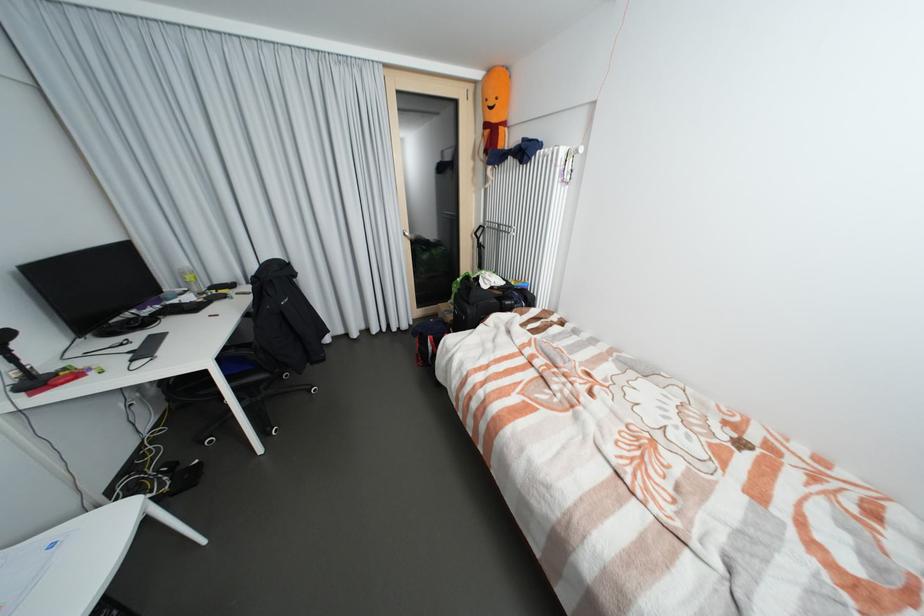
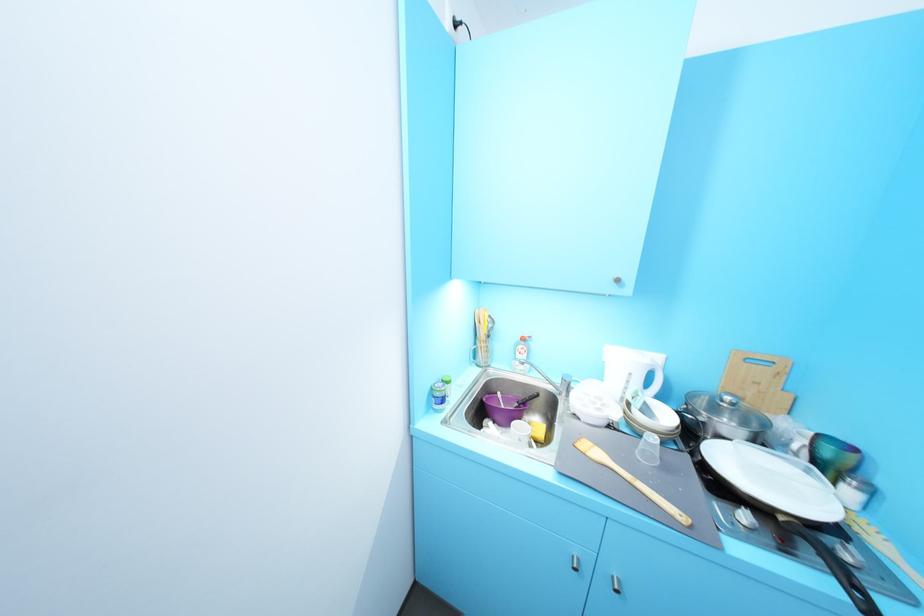
Question: I am providing you with two images of the same scene from different viewpoints. After the viewpoint changes to image2, which objects are now occluded?

Choices:
 (A) silver door handle
 (B) sink faucet handle
 (C) kettle handle
 (D) colorful thin book

Answer: (A)